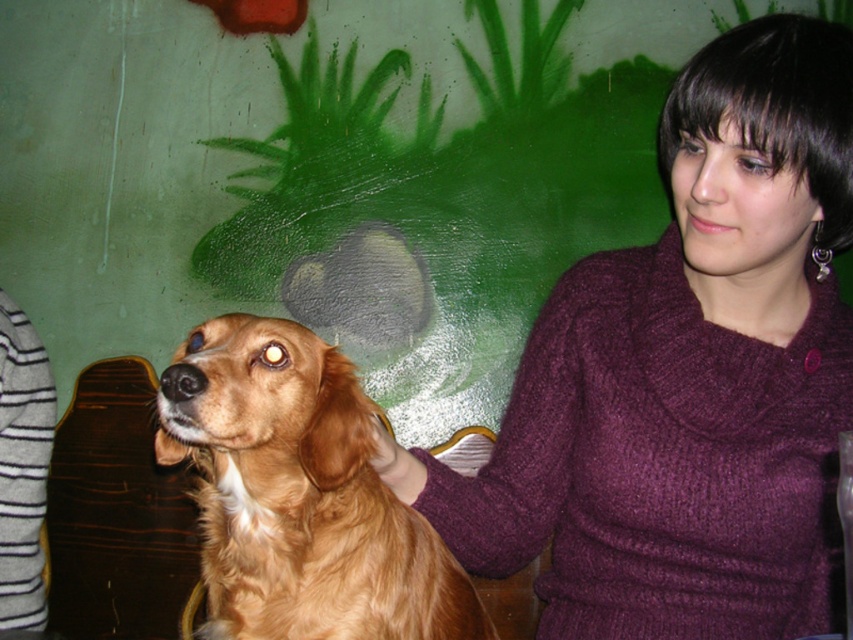
You are holding a 90 cm wide poster and want to place it on the wall in the image. The point at coordinate (732, 449) is where you want to center the poster. Can the poster fit without overlapping the golden dog or the person in the maroon sweater?

The point at coordinate (732, 449) is 95.43 centimeters from the camera. Since the poster is 90 cm wide, it can be centered at this point without overlapping the golden dog or the person in the maroon sweater as the distance allows sufficient space.

You are a tailor who needs to determine which item is wider between the knitted purple sweater at center and the golden fur dog at center. Based on the scene, which one is wider?

The knitted purple sweater at center is wider than the golden fur dog at center according to the description.

You are a photographer setting up a shoot in this scene. You need to ensure that the knitted purple sweater at center and the golden fur dog at center are both in frame. Based on their positions, which object is higher up in the image?

The knitted purple sweater at center is above the golden fur dog at center, so the knitted purple sweater at center is higher up in the image.